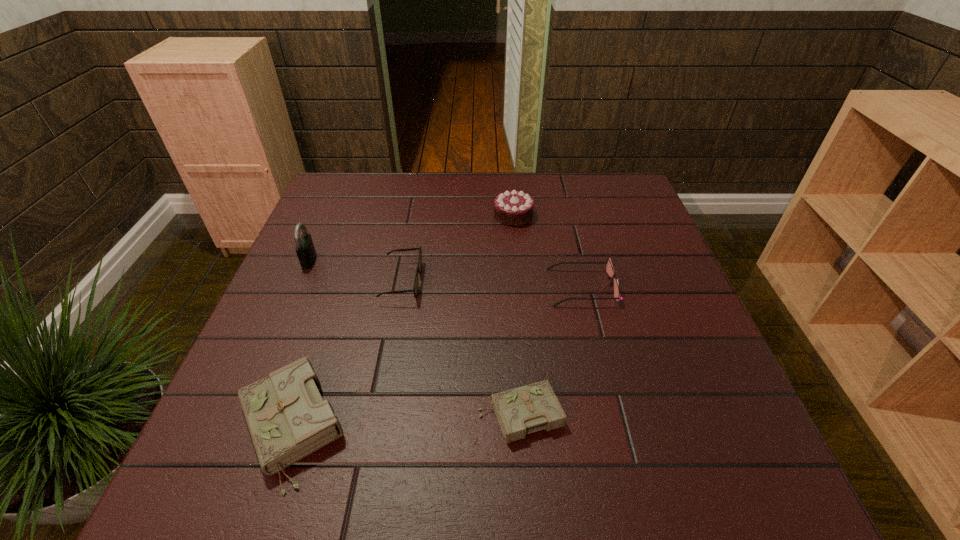
Identify the location of vacant space that satisfies the following two spatial constraints: 1. on the front-facing side of the left sunglasses; 2. on the back side of the right diary. (376, 414).

This screenshot has height=540, width=960. Find the location of `vacant space that satisfies the following two spatial constraints: 1. on the front side of the farthest object; 2. on the front-facing side of the left sunglasses`. vacant space that satisfies the following two spatial constraints: 1. on the front side of the farthest object; 2. on the front-facing side of the left sunglasses is located at coordinates (519, 281).